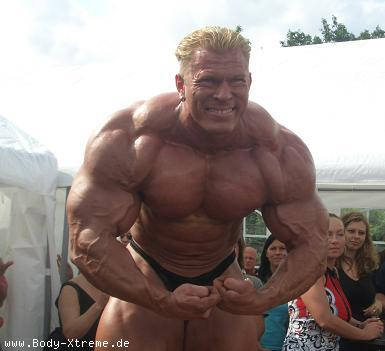
You are a GUI agent. You are given a task and a screenshot of the screen. Output one action in this format:
    pyautogui.click(x=<x>, y=<y>)
    Task: Click on the wall
    
    Given the screenshot: What is the action you would take?
    pyautogui.click(x=41, y=217)